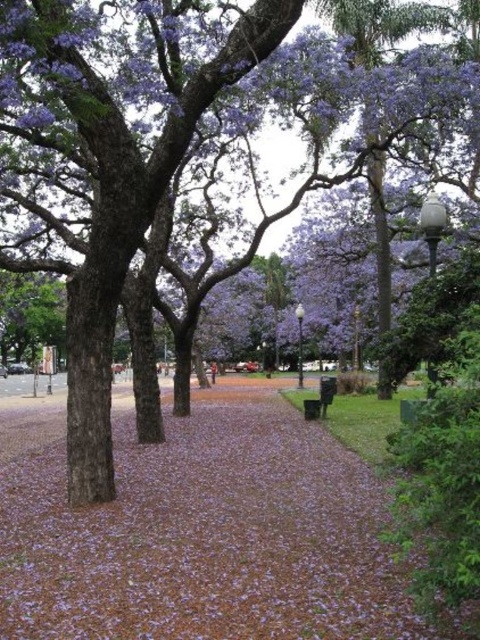
Question: Is purple matte petals at center positioned at the back of black plastic bench at center?

Choices:
 (A) no
 (B) yes

Answer: (A)

Question: Is purple matte petals at center below black plastic bench at center?

Choices:
 (A) yes
 (B) no

Answer: (A)

Question: Which of the following is the farthest from the observer?

Choices:
 (A) (84, 512)
 (B) (324, 381)

Answer: (B)

Question: Does purple matte petals at center come behind black plastic bench at center?

Choices:
 (A) yes
 (B) no

Answer: (B)

Question: Which of the following is the farthest from the observer?

Choices:
 (A) purple matte petals at center
 (B) black plastic bench at center

Answer: (B)